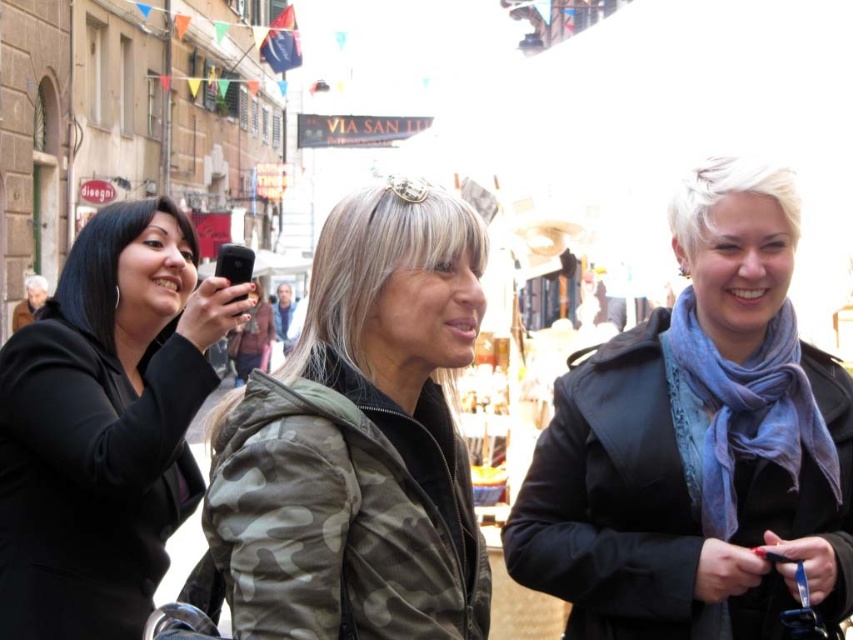
Who is shorter, blue scarf at center or black matte phone at left?

black matte phone at left

Which is in front, point (631, 637) or point (59, 497)?

Positioned in front is point (631, 637).

Where is `blue scarf at center`? blue scarf at center is located at coordinates (697, 442).

Can you confirm if camo-patterned jacket at center is bigger than black matte phone at left?

No, camo-patterned jacket at center is not bigger than black matte phone at left.

The width and height of the screenshot is (853, 640). What do you see at coordinates (358, 440) in the screenshot?
I see `camo-patterned jacket at center` at bounding box center [358, 440].

Identify the location of camo-patterned jacket at center. (358, 440).

Which is above, blue scarf at center or camo-patterned jacket at center?

camo-patterned jacket at center is higher up.

This screenshot has height=640, width=853. Identify the location of blue scarf at center. (697, 442).